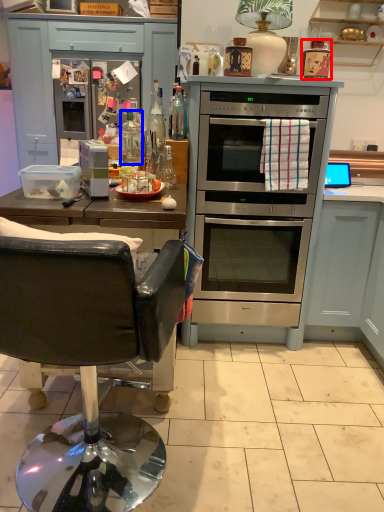
Question: Which point is closer to the camera, appliance (highlighted by a red box) or bottle (highlighted by a blue box)?

Choices:
 (A) appliance
 (B) bottle

Answer: (A)